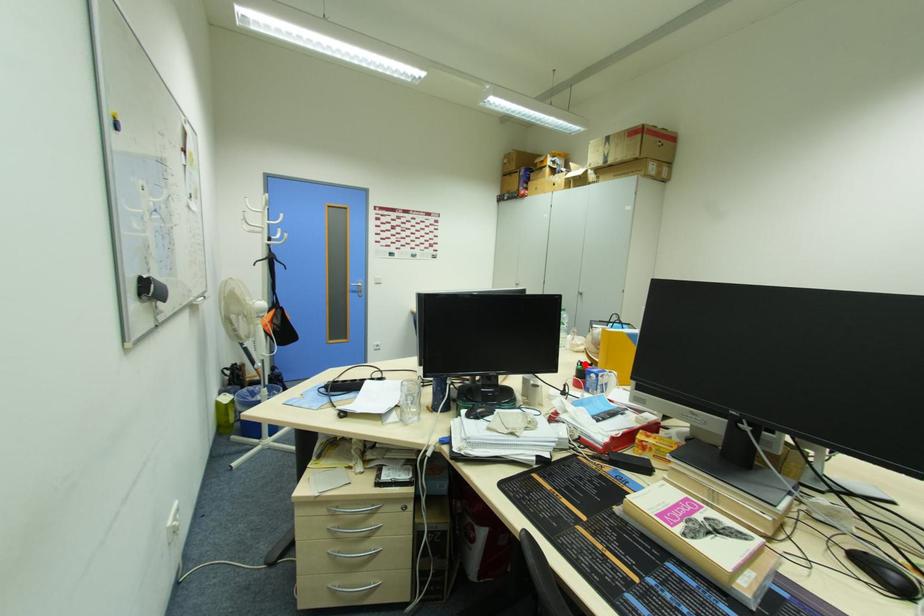
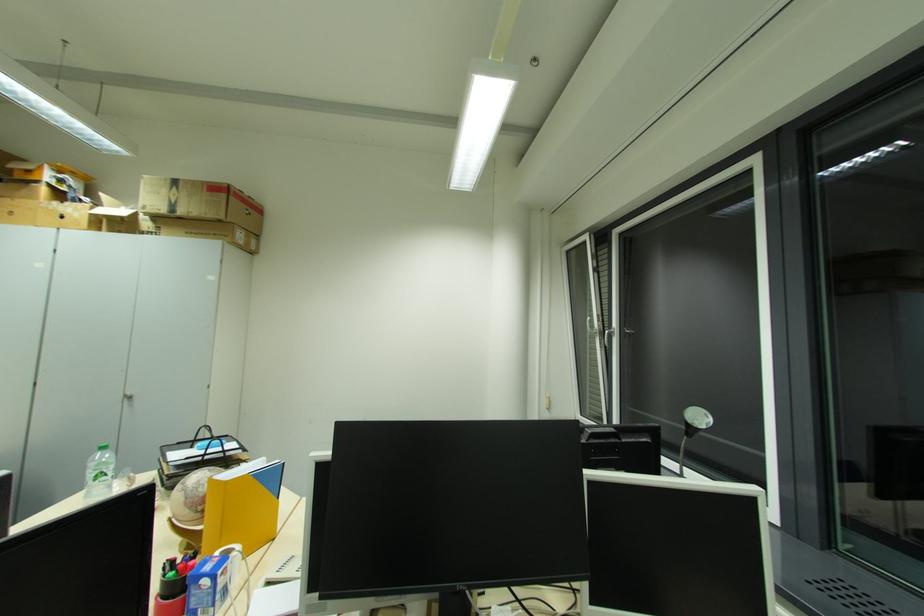
Find the pixel in the second image that matches the highlighted location in the first image.

(176, 564)